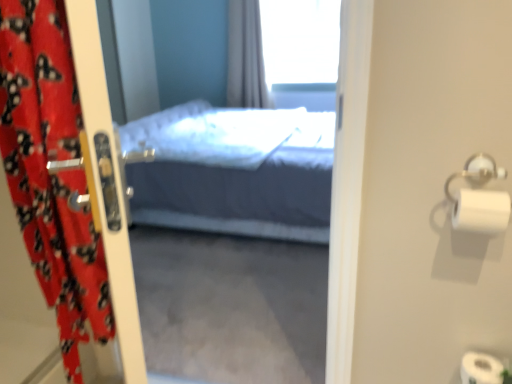
You are a GUI agent. You are given a task and a screenshot of the screen. Output one action in this format:
    pyautogui.click(x=<x>, y=<y>)
    Task: Click on the transparent glass window at upper center
    The width and height of the screenshot is (512, 384).
    Given the screenshot: What is the action you would take?
    pyautogui.click(x=300, y=41)

Image resolution: width=512 pixels, height=384 pixels. Describe the element at coordinates (477, 172) in the screenshot. I see `silver metallic towel bar at right` at that location.

I want to click on white matte toilet paper at right, so click(481, 211).

From a real-world perspective, is silver metallic towel bar at right beneath red fabric curtain at left?

No, from a real-world perspective, silver metallic towel bar at right is not beneath red fabric curtain at left.

Is silver metallic towel bar at right taller than red fabric curtain at left?

In fact, silver metallic towel bar at right may be shorter than red fabric curtain at left.

Considering the points (504, 178) and (82, 256), which point is behind, point (504, 178) or point (82, 256)?

The point (504, 178) is behind.

Does silver metallic towel bar at right turn towards red fabric curtain at left?

No, silver metallic towel bar at right is not aimed at red fabric curtain at left.

Is red fabric curtain at left bigger or smaller than transparent glass window at upper center?

Clearly, red fabric curtain at left is smaller in size than transparent glass window at upper center.

Does red fabric curtain at left appear on the left side of transparent glass window at upper center?

Indeed, red fabric curtain at left is positioned on the left side of transparent glass window at upper center.

From their relative heights in the image, would you say red fabric curtain at left is taller or shorter than transparent glass window at upper center?

red fabric curtain at left is taller than transparent glass window at upper center.

Between red fabric curtain at left and white matte toilet paper at right, which one is positioned behind?

Positioned behind is white matte toilet paper at right.

What's the angular difference between red fabric curtain at left and white matte toilet paper at right's facing directions?

49.6 degrees separate the facing orientations of red fabric curtain at left and white matte toilet paper at right.

From a real-world perspective, is red fabric curtain at left on top of white matte toilet paper at right?

Yes, from a real-world perspective, red fabric curtain at left is over white matte toilet paper at right

Which point is more forward, (47,45) or (494,196)?

Point (47,45)

Considering the points (476, 197) and (499, 171), which point is in front, point (476, 197) or point (499, 171)?

Positioned in front is point (476, 197).

Identify the location of towel bar located above the white matte toilet paper at right (from a real-world perspective). This screenshot has width=512, height=384. (477, 172).

Does white matte toilet paper at right come behind silver metallic towel bar at right?

No, it is not.

Which object is positioned more to the right, white matte toilet paper at right or silver metallic towel bar at right?

From the viewer's perspective, white matte toilet paper at right appears more on the right side.

Looking at their sizes, would you say silver metallic towel bar at right is wider or thinner than transparent glass window at upper center?

In the image, silver metallic towel bar at right appears to be more narrow than transparent glass window at upper center.

How different are the orientations of silver metallic towel bar at right and transparent glass window at upper center in degrees?

The facing directions of silver metallic towel bar at right and transparent glass window at upper center are 0.265 degrees apart.

Between point (478, 166) and point (284, 8), which one is positioned in front?

Point (478, 166)

Would you say silver metallic towel bar at right contains transparent glass window at upper center?

No, transparent glass window at upper center is located outside of silver metallic towel bar at right.

From the image's perspective, would you say transparent glass window at upper center is positioned over silver metallic towel bar at right?

Yes, from the image's perspective, transparent glass window at upper center is over silver metallic towel bar at right.

Who is more distant, transparent glass window at upper center or silver metallic towel bar at right?

transparent glass window at upper center is further from the camera.

Is transparent glass window at upper center outside of silver metallic towel bar at right?

Absolutely, transparent glass window at upper center is external to silver metallic towel bar at right.

Is point (331, 24) farther from camera compared to point (502, 176)?

Yes, point (331, 24) is farther from viewer.

From the image's perspective, is transparent glass window at upper center on top of white matte toilet paper at right?

Indeed, from the image's perspective, transparent glass window at upper center is shown above white matte toilet paper at right.

Which is behind, transparent glass window at upper center or white matte toilet paper at right?

Positioned behind is transparent glass window at upper center.

Does transparent glass window at upper center turn towards white matte toilet paper at right?

Yes, transparent glass window at upper center is oriented towards white matte toilet paper at right.

How many degrees apart are the facing directions of transparent glass window at upper center and white matte toilet paper at right?

They differ by 1.64 degrees in their facing directions.

In order to click on towel bar positioned vertically above the red fabric curtain at left (from a real-world perspective) in this screenshot , I will do `click(477, 172)`.

Locate an element on the screen. window behind the red fabric curtain at left is located at coordinates (300, 41).

When comparing their distances from silver metallic towel bar at right, does white matte toilet paper at right or transparent glass window at upper center seem further?

transparent glass window at upper center is positioned further to the anchor silver metallic towel bar at right.

Based on their spatial positions, is red fabric curtain at left or transparent glass window at upper center closer to silver metallic towel bar at right?

The object closer to silver metallic towel bar at right is red fabric curtain at left.

Which object lies further to the anchor point silver metallic towel bar at right, transparent glass window at upper center or white matte toilet paper at right?

transparent glass window at upper center lies further to silver metallic towel bar at right than the other object.

From the image, which object appears to be nearer to transparent glass window at upper center, silver metallic towel bar at right or white matte toilet paper at right?

Among the two, silver metallic towel bar at right is located nearer to transparent glass window at upper center.

Based on their spatial positions, is silver metallic towel bar at right or red fabric curtain at left closer to white matte toilet paper at right?

Among the two, silver metallic towel bar at right is located nearer to white matte toilet paper at right.

Which object lies further to the anchor point red fabric curtain at left, silver metallic towel bar at right or white matte toilet paper at right?

silver metallic towel bar at right.

Which object lies nearer to the anchor point transparent glass window at upper center, white matte toilet paper at right or silver metallic towel bar at right?

Based on the image, silver metallic towel bar at right appears to be nearer to transparent glass window at upper center.

From the image, which object appears to be nearer to white matte toilet paper at right, transparent glass window at upper center or silver metallic towel bar at right?

Among the two, silver metallic towel bar at right is located nearer to white matte toilet paper at right.

Identify the location of towel bar located between white matte toilet paper at right and transparent glass window at upper center in the depth direction. The image size is (512, 384). (477, 172).

Where is `towel bar located between red fabric curtain at left and white matte toilet paper at right in the left-right direction`? The height and width of the screenshot is (384, 512). towel bar located between red fabric curtain at left and white matte toilet paper at right in the left-right direction is located at coordinates (477, 172).

Locate an element on the screen. toilet paper between red fabric curtain at left and transparent glass window at upper center in the front-back direction is located at coordinates (481, 211).

I want to click on towel bar between red fabric curtain at left and transparent glass window at upper center along the z-axis, so coord(477,172).